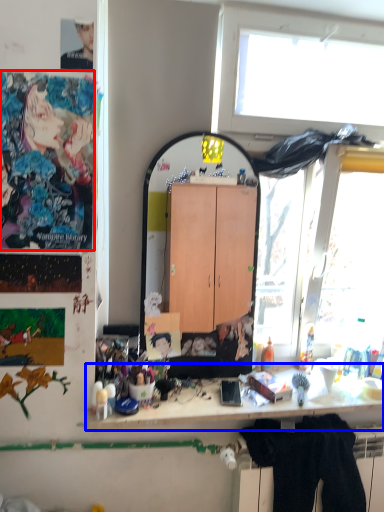
Question: Which of the following is the closest to the observer, person (highlighted by a red box) or desk (highlighted by a blue box)?

Choices:
 (A) person
 (B) desk

Answer: (A)